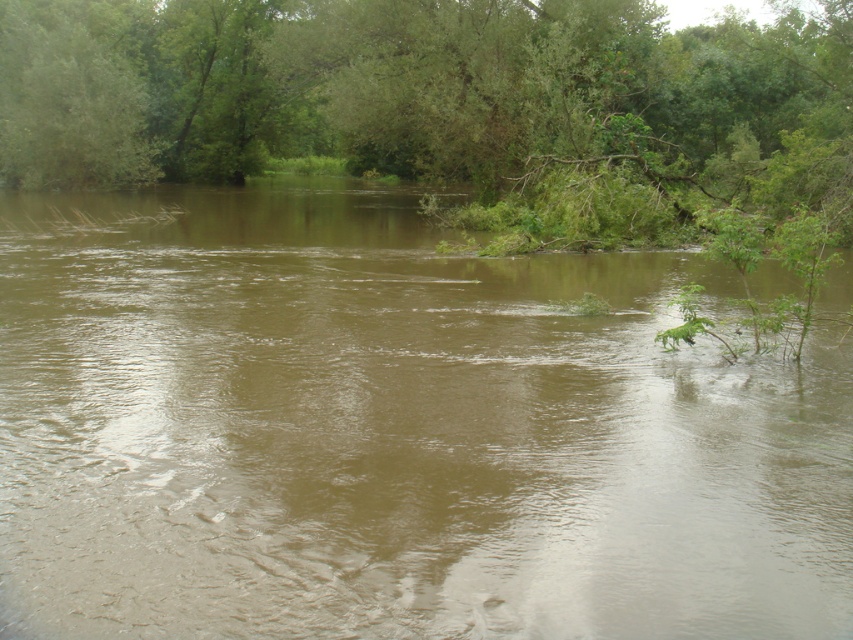
Is brown muddy water at center closer to the viewer compared to green leafy tree at upper center?

That is True.

Does brown muddy water at center have a lesser height compared to green leafy tree at upper center?

A: Indeed, brown muddy water at center has a lesser height compared to green leafy tree at upper center.

Is point (431, 282) positioned before point (281, 118)?

Yes, point (431, 282) is closer to viewer.

Image resolution: width=853 pixels, height=640 pixels. In order to click on brown muddy water at center in this screenshot , I will do `click(392, 433)`.